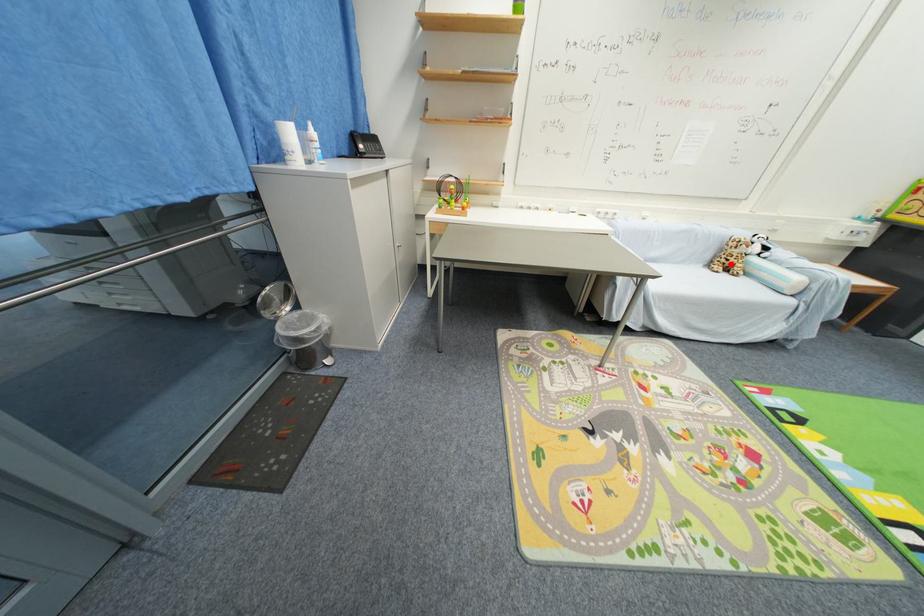
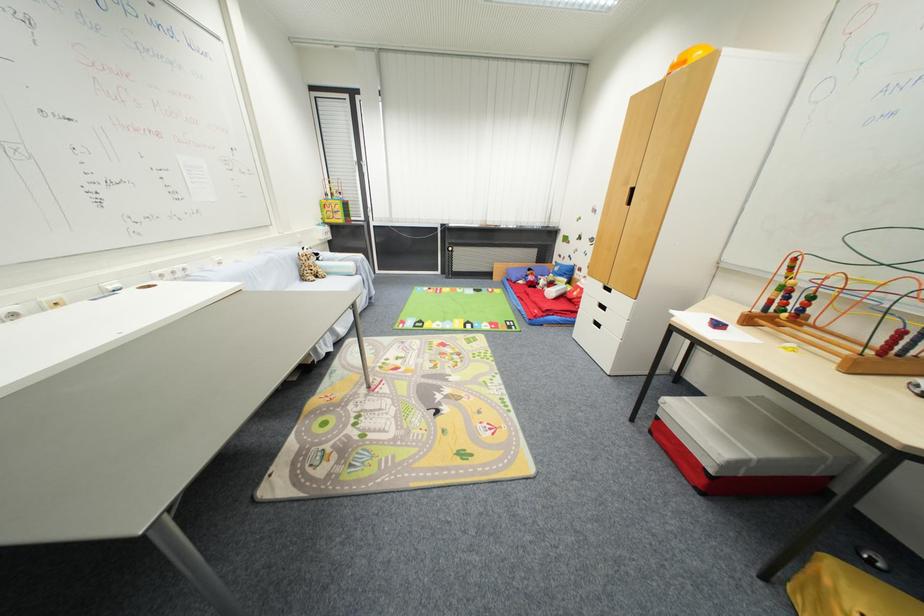
Question: I am providing you with two images of the same scene from different viewpoints. A red point is shown in image1. For the corresponding object point in image2, is it positioned nearer or farther from the camera?

Choices:
 (A) Nearer
 (B) Farther

Answer: (B)